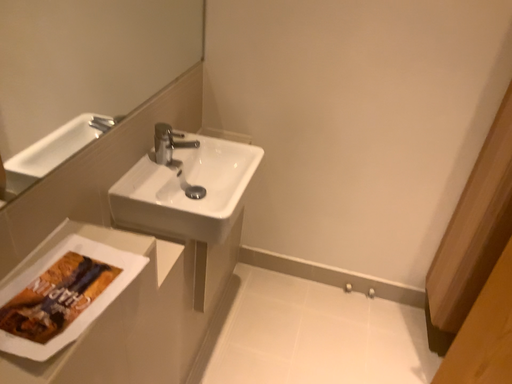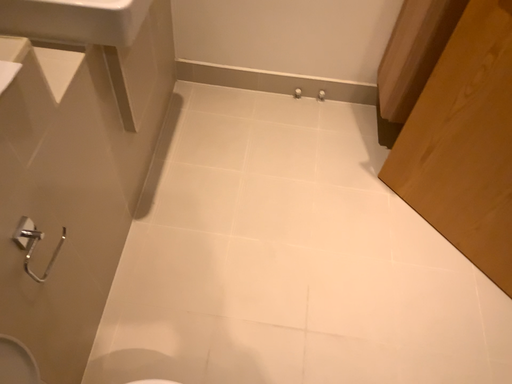
Question: Which way did the camera rotate in the video?

Choices:
 (A) rotated upward
 (B) rotated downward

Answer: (B)